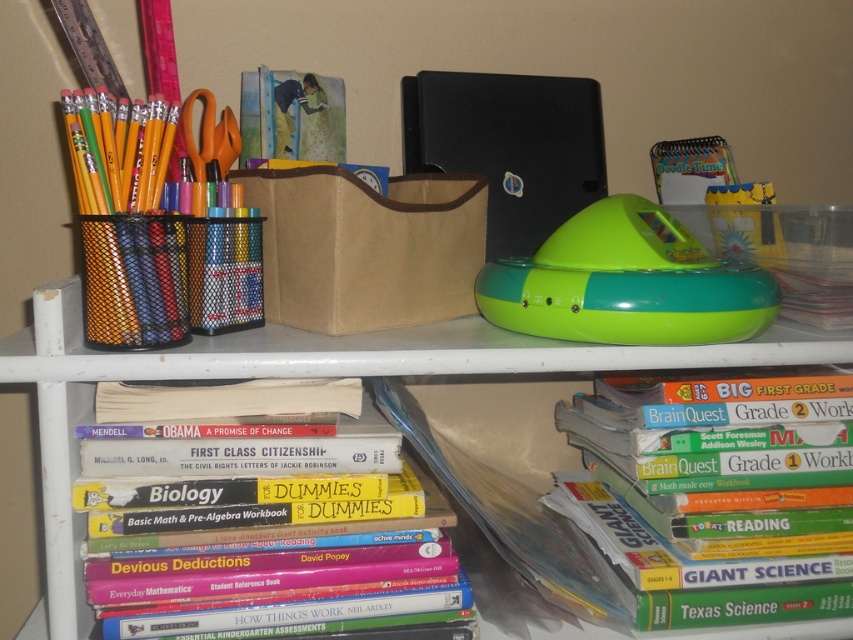
Question: Does yellow paperback book at center have a greater width compared to green plastic toy at center?

Choices:
 (A) yes
 (B) no

Answer: (A)

Question: Does green matte book at lower right come in front of yellow paperback book at center?

Choices:
 (A) no
 (B) yes

Answer: (A)

Question: Is green matte book at lower right closer to the viewer compared to yellow paperback book at center?

Choices:
 (A) yes
 (B) no

Answer: (B)

Question: Which object appears closest to the camera in this image?

Choices:
 (A) green plastic speaker at upper center
 (B) green matte book at lower right

Answer: (A)

Question: Which object is farther from the camera taking this photo?

Choices:
 (A) green plastic speaker at upper center
 (B) yellow paperback book at center

Answer: (B)

Question: Which object appears closest to the camera in this image?

Choices:
 (A) green matte book at lower right
 (B) yellow paperback book at center
 (C) green plastic speaker at upper center

Answer: (C)